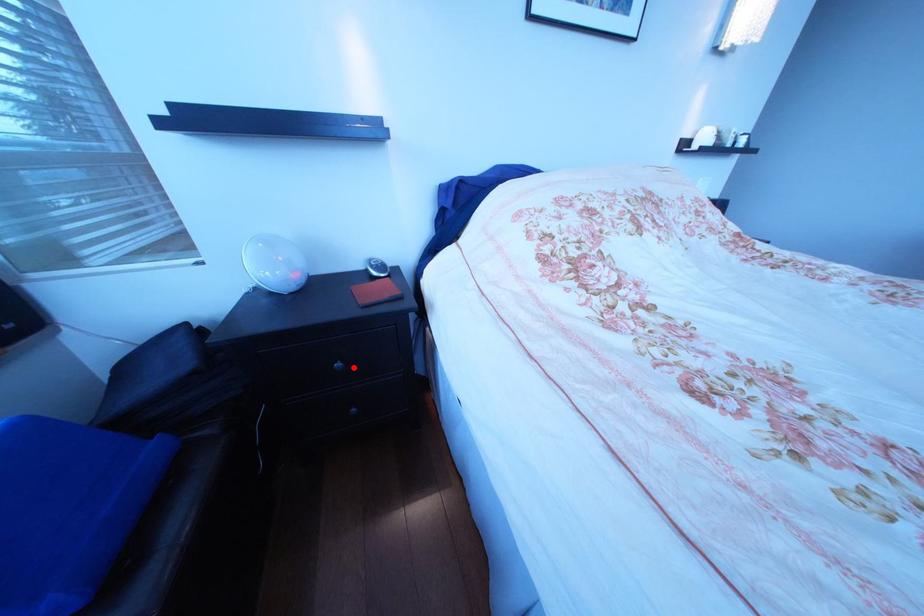
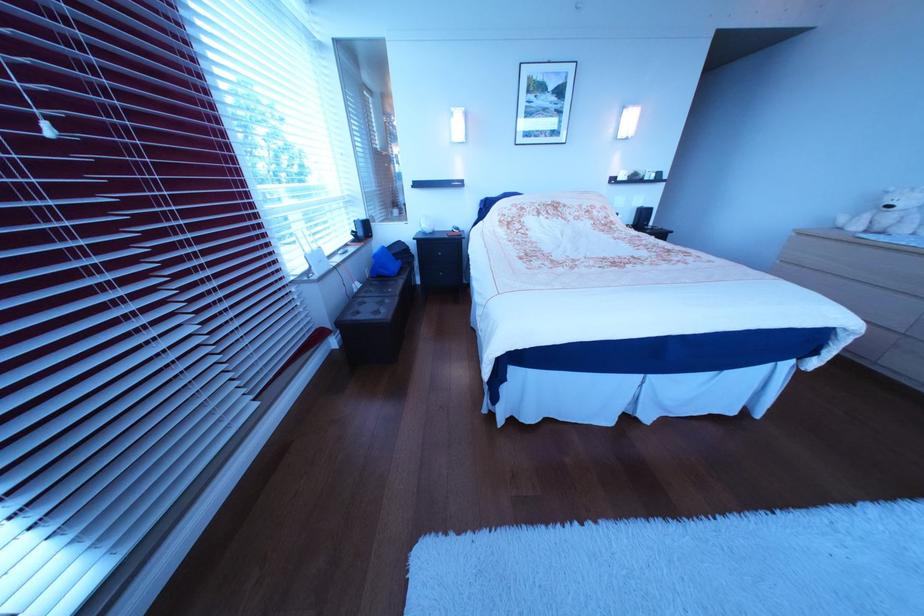
Question: I am providing you with two images of the same scene from different viewpoints. A red point is marked on the first image. Is the red point's position out of view in image 2?

Choices:
 (A) Yes
 (B) No

Answer: (B)